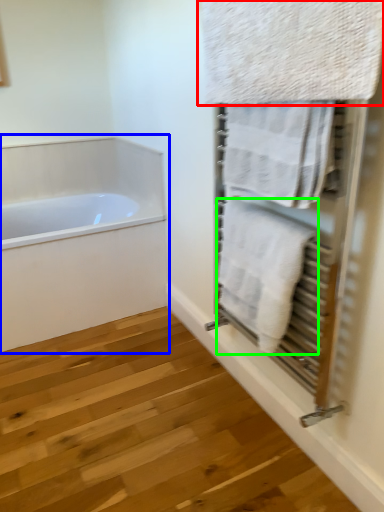
Question: Which object is positioned closest to towel (highlighted by a red box)? Select from bathtub (highlighted by a blue box) and towel (highlighted by a green box).

Choices:
 (A) bathtub
 (B) towel

Answer: (B)